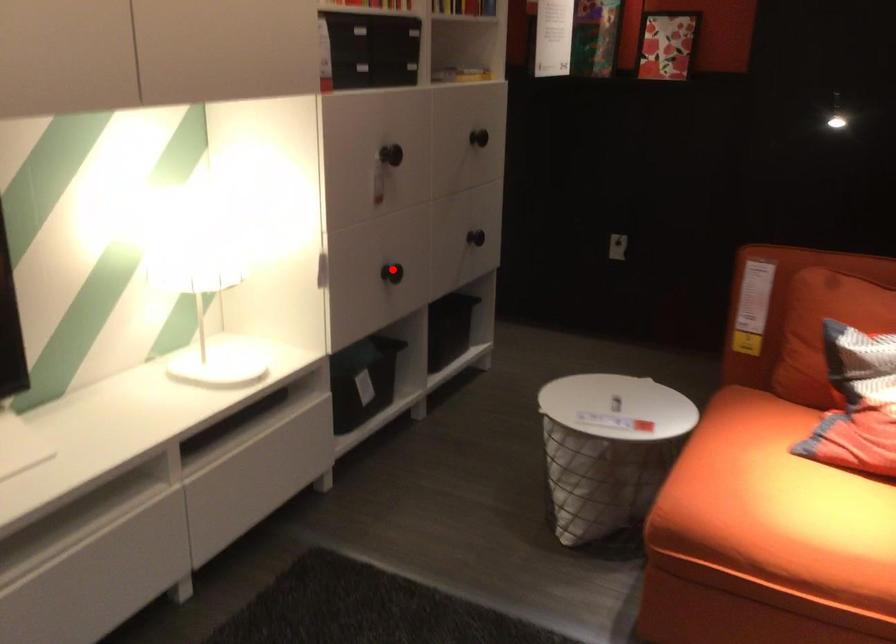
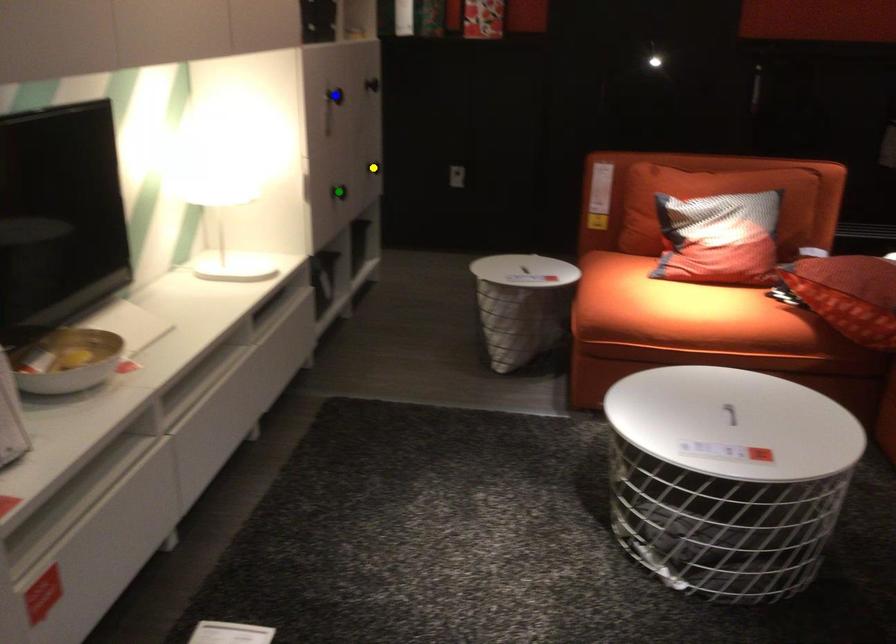
Question: I am providing you with two images of the same scene from different viewpoints. A red point is marked on the first image. You are given multiple points on the second image. Can you choose the point in image 2 that corresponds to the point in image 1?

Choices:
 (A) green point
 (B) yellow point
 (C) blue point

Answer: (A)